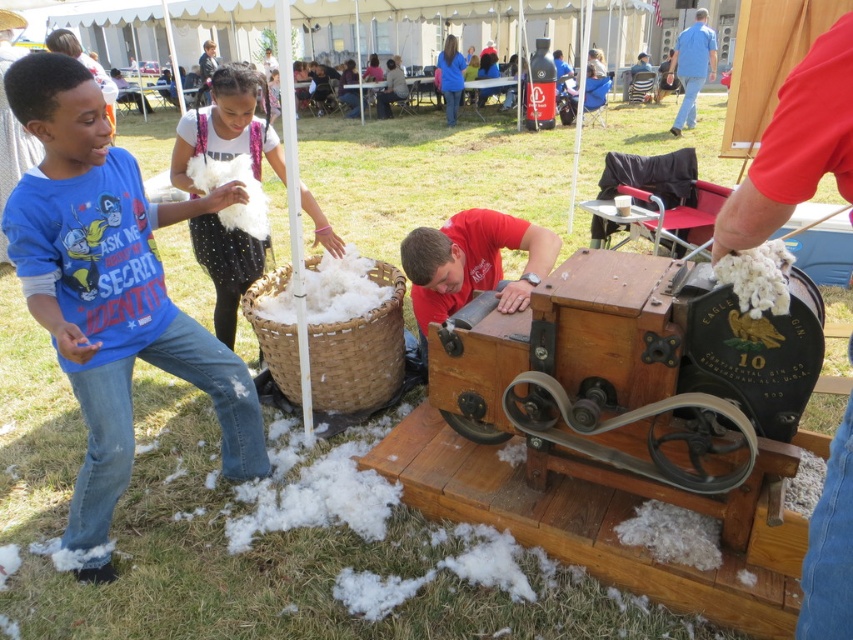
You are a vendor at the fair and want to place a decorative ribbon between the blue cotton shirt at left and the white fluffy cotton at center. How far apart are these two items?

The blue cotton shirt at left and the white fluffy cotton at center are 34.45 inches apart.

You are standing at the community fair and want to take a photo of the Eagle Gin machine. To get the best angle, you need to position yourself between the two points marked as point (x=4, y=77) and point (x=712, y=61). Which point should you stand closer to for the Eagle Gin to be more visible in your photo?

You should stand closer to point (x=4, y=77) because it is in front of point (x=712, y=61), making the Eagle Gin machine more visible from that vantage point.